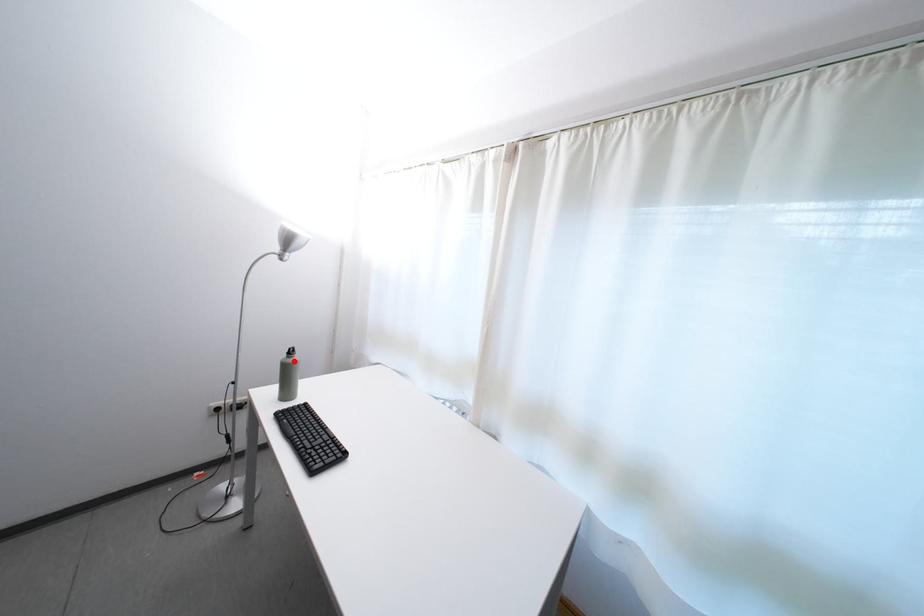
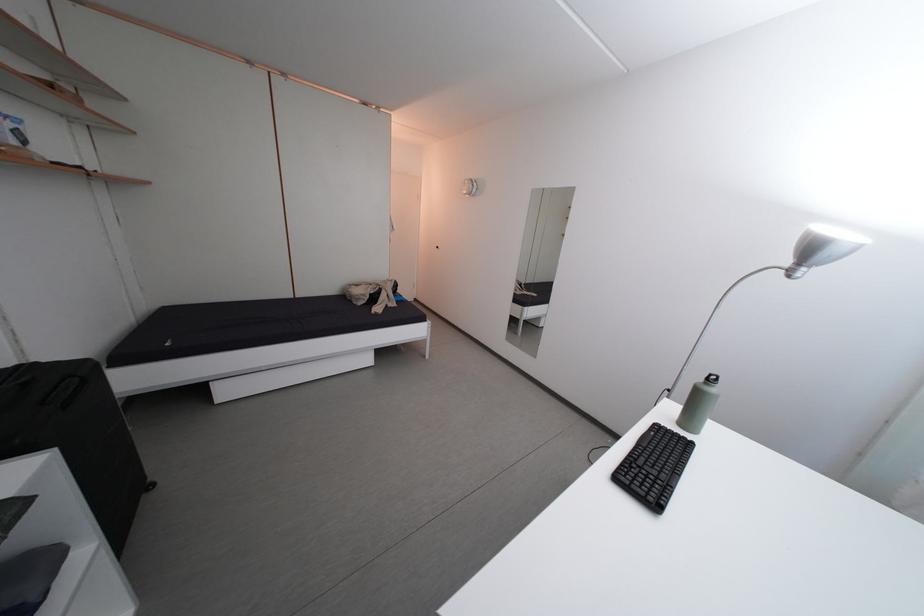
Question: I am providing you with two images of the same scene from different viewpoints. Image1 has a red point marked. In image2, the corresponding 3D location appears at what relative position? Reply with the corresponding letter.

Choices:
 (A) Closer
 (B) Farther

Answer: (B)